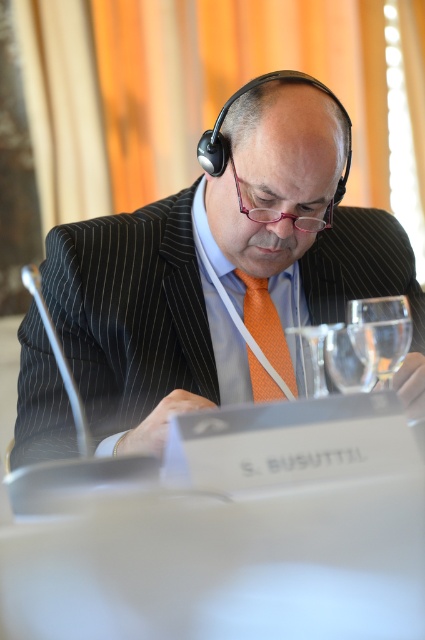
Is matte black suit at center in front of orange textured tie at center?

Yes, it is.

At what (x,y) coordinates should I click in order to perform the action: click on matte black suit at center. Please return your answer as a coordinate pair (x, y). This screenshot has height=640, width=425. Looking at the image, I should click on (226, 269).

Is point (362, 321) behind point (365, 333)?

Yes, point (362, 321) is behind point (365, 333).

Does transparent glass at right appear on the right side of clear glass wine glass at center?

Correct, you'll find transparent glass at right to the right of clear glass wine glass at center.

The image size is (425, 640). Describe the element at coordinates (380, 332) in the screenshot. I see `transparent glass at right` at that location.

At what (x,y) coordinates should I click in order to perform the action: click on transparent glass at right. Please return your answer as a coordinate pair (x, y). The image size is (425, 640). Looking at the image, I should click on (380, 332).

Is orange textured tie at center shorter than clear glass wine glass at center?

No.

Between orange textured tie at center and clear glass wine glass at center, which one has less height?

clear glass wine glass at center

Describe the element at coordinates (266, 326) in the screenshot. I see `orange textured tie at center` at that location.

Locate an element on the screen. The width and height of the screenshot is (425, 640). orange textured tie at center is located at coordinates (266, 326).